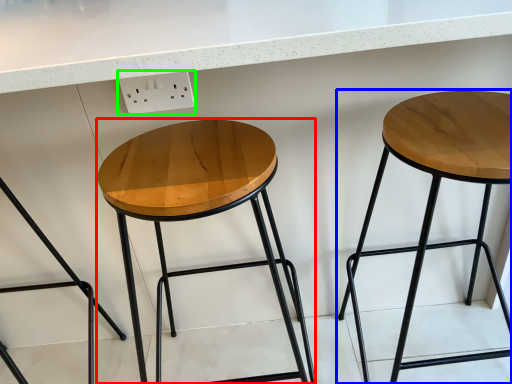
Question: Which is farther away from stool (highlighted by a red box)? stool (highlighted by a blue box) or electric outlet (highlighted by a green box)?

Choices:
 (A) stool
 (B) electric outlet

Answer: (A)